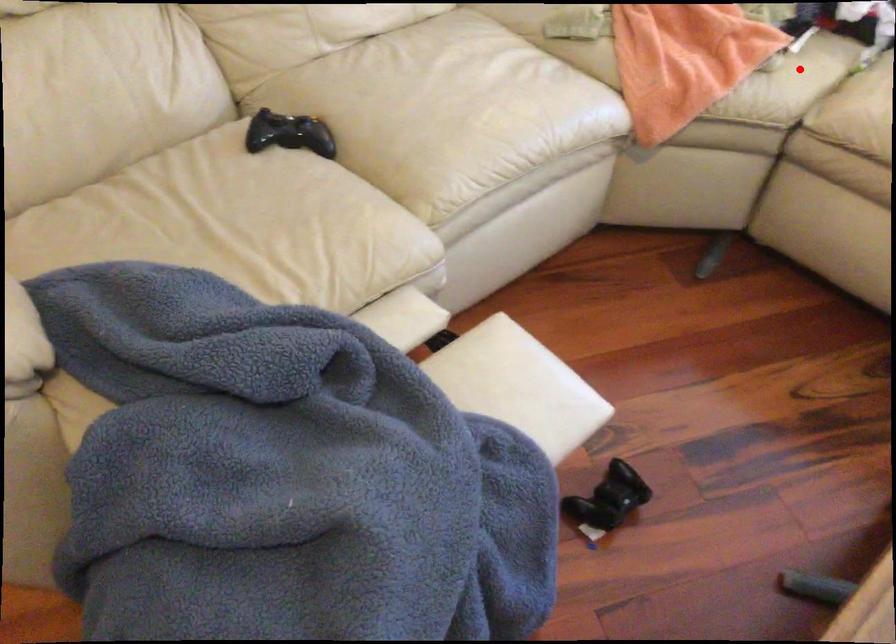
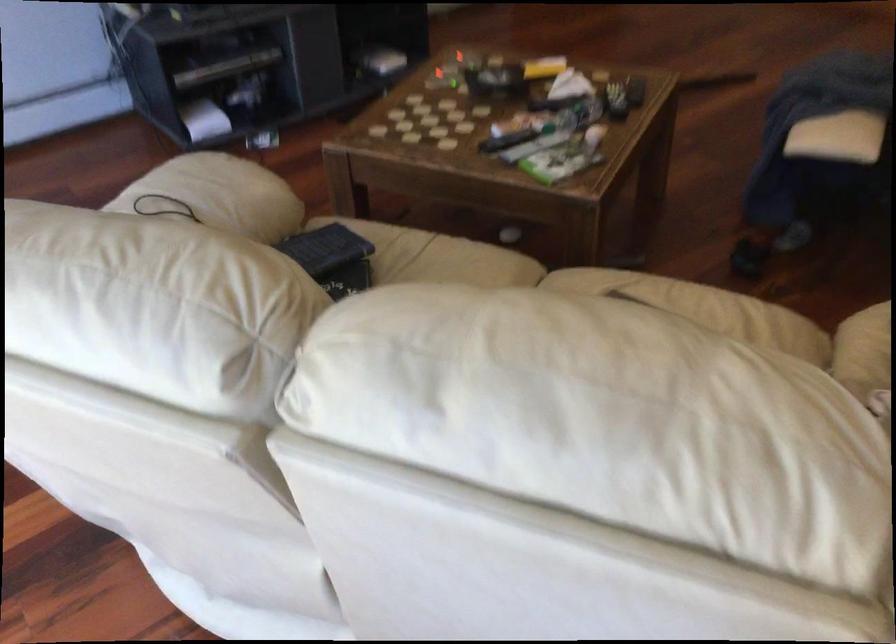
Question: I am providing you with two images of the same scene from different viewpoints. A red point is shown in image1. For the corresponding object point in image2, is it positioned nearer or farther from the camera?

Choices:
 (A) Nearer
 (B) Farther

Answer: (A)